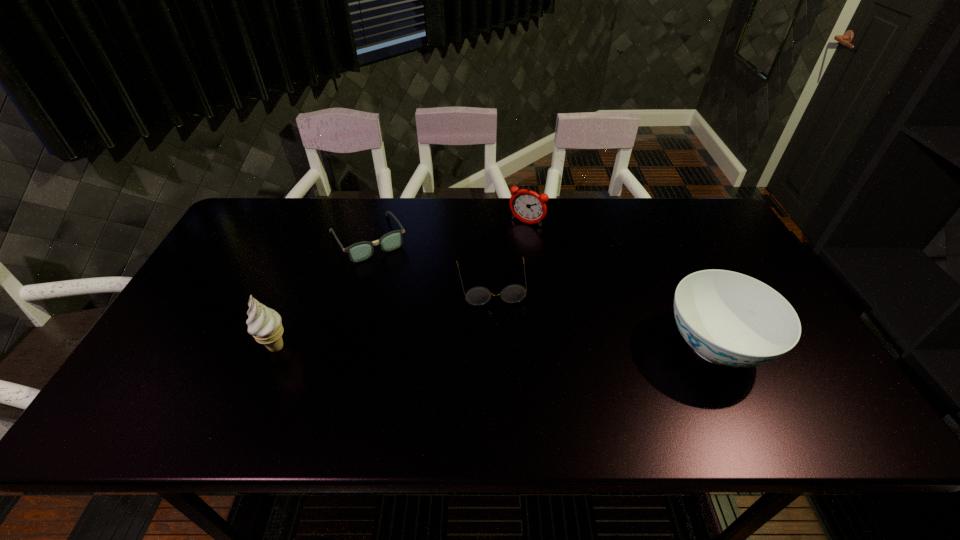
The width and height of the screenshot is (960, 540). What are the coordinates of `vacant space located on the front-facing side of the alarm clock` in the screenshot? It's located at (490, 273).

This screenshot has width=960, height=540. I want to click on vacant space located 0.390m on the front-facing side of the alarm clock, so click(465, 310).

In order to click on vacant space positioned 0.050m on the front-facing side of the alarm clock in this screenshot , I will do `click(514, 238)`.

This screenshot has width=960, height=540. Find the location of `vacant area located 0.200m on the temples of the right spectacles`. vacant area located 0.200m on the temples of the right spectacles is located at coordinates (503, 369).

The height and width of the screenshot is (540, 960). What are the coordinates of `free space located 0.150m on the temples of the right spectacles` in the screenshot? It's located at (500, 352).

Image resolution: width=960 pixels, height=540 pixels. Find the location of `vacant space located 0.210m on the temples of the right spectacles`. vacant space located 0.210m on the temples of the right spectacles is located at coordinates (504, 373).

Locate an element on the screen. spectacles that is positioned at the far edge is located at coordinates (360, 251).

The image size is (960, 540). In order to click on alarm clock that is at the far edge in this screenshot , I will do `click(526, 205)`.

Locate an element on the screen. This screenshot has width=960, height=540. object that is at the near edge is located at coordinates (728, 318).

Where is `object that is at the right edge`? object that is at the right edge is located at coordinates (728, 318).